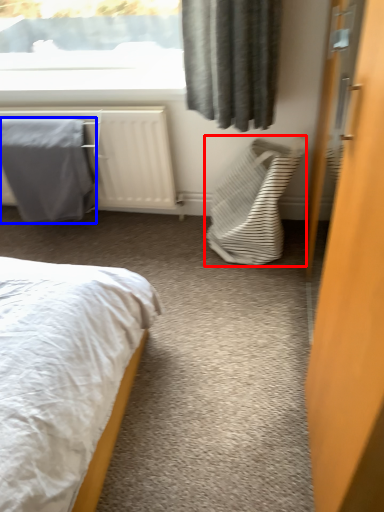
Question: Which of the following is the farthest to the observer, laundry basket (highlighted by a red box) or blanket (highlighted by a blue box)?

Choices:
 (A) laundry basket
 (B) blanket

Answer: (B)